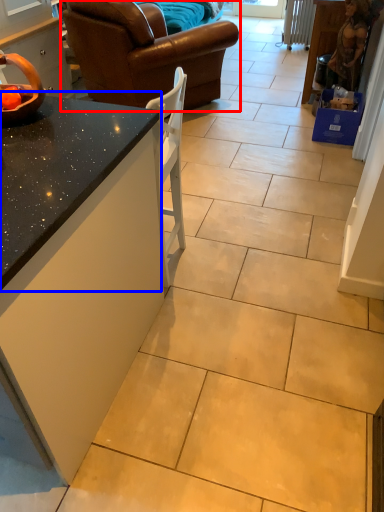
Question: Which of the following is the closest to the observer, studio couch (highlighted by a red box) or countertop (highlighted by a blue box)?

Choices:
 (A) studio couch
 (B) countertop

Answer: (B)